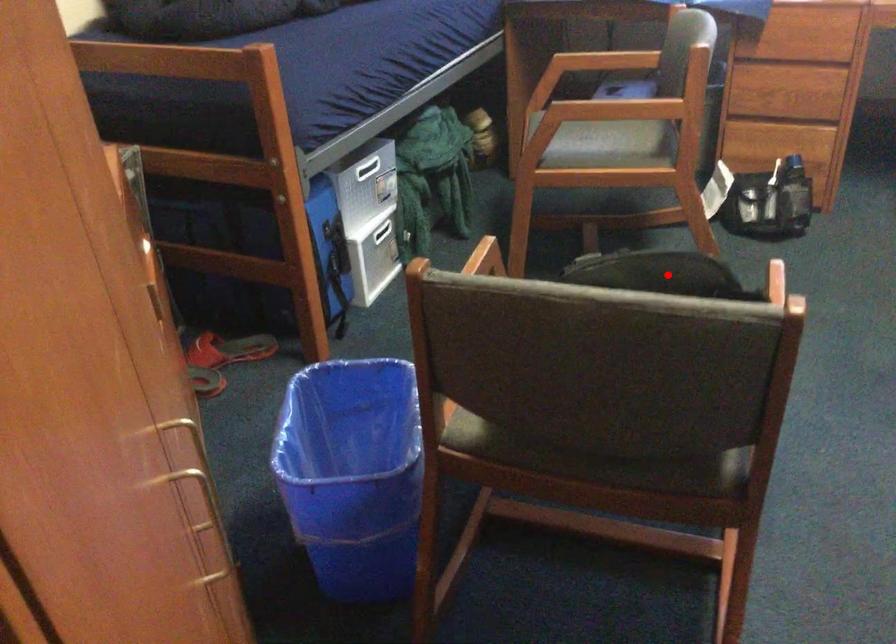
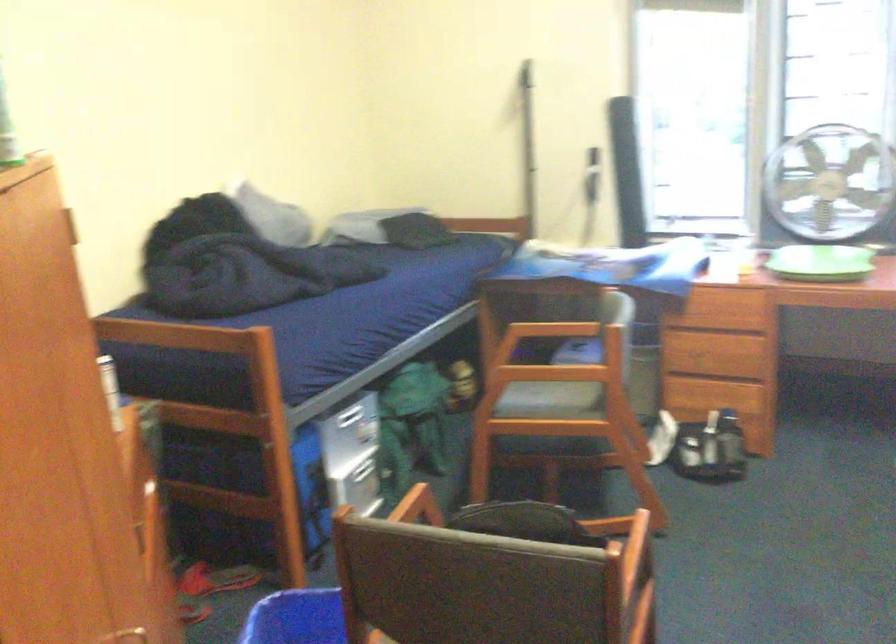
Question: I am providing you with two images of the same scene from different viewpoints. In image1, a red point is highlighted. Considering the same 3D point in image2, which of the following is correct?

Choices:
 (A) It is closer
 (B) It is farther

Answer: (B)